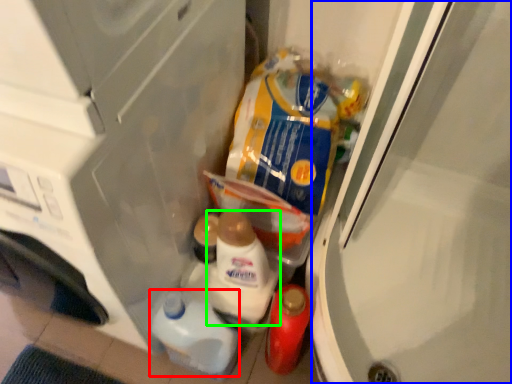
Question: Which object is the closest to the snack (highlighted by a red box)? Choose among these: screen door (highlighted by a blue box) or snack (highlighted by a green box).

Choices:
 (A) screen door
 (B) snack

Answer: (B)